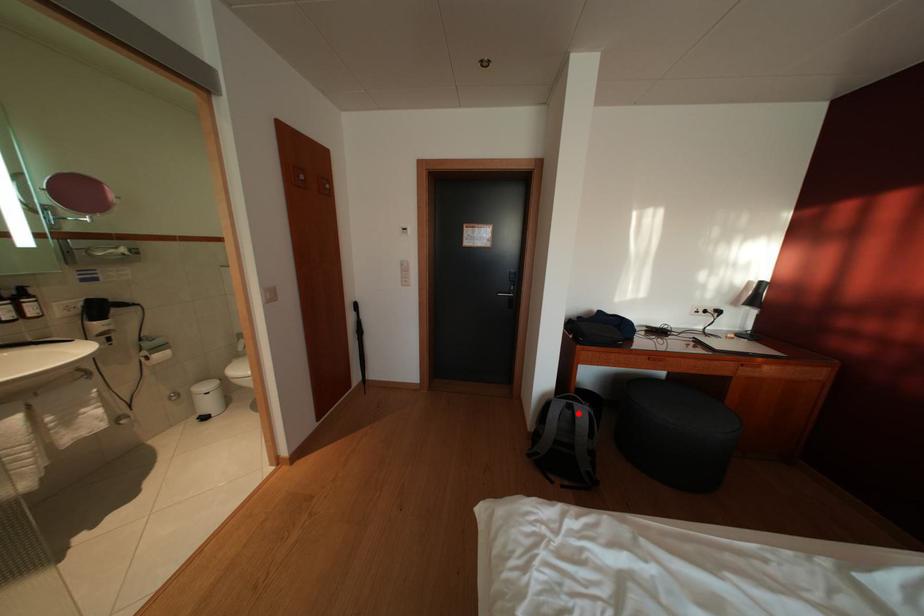
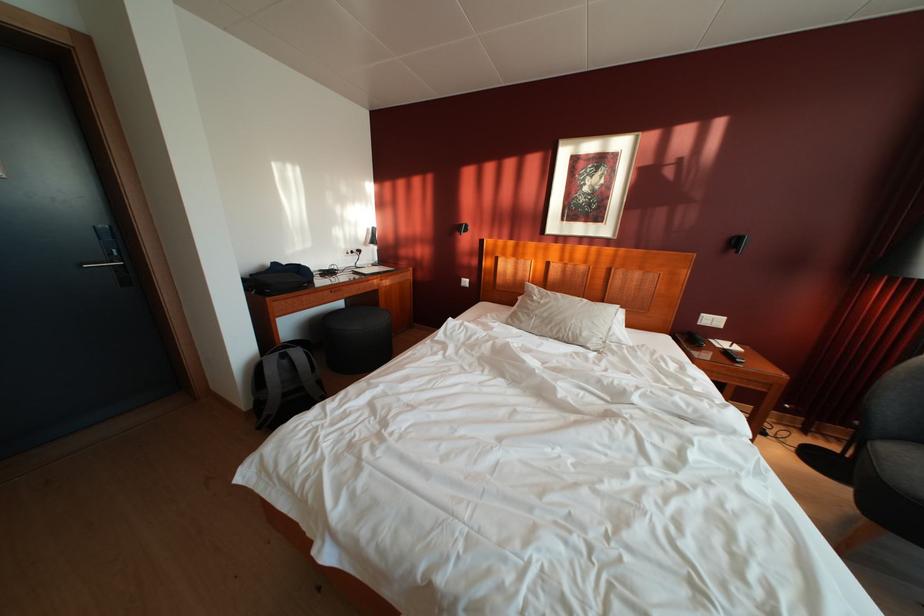
Question: I am providing you with two images of the same scene from different viewpoints. Given a red point in image1, look at the same physical point in image2. Is it:

Choices:
 (A) Closer to the viewpoint
 (B) Farther from the viewpoint

Answer: (A)